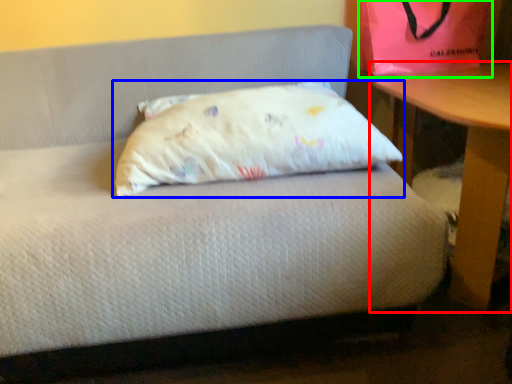
Question: Based on their relative distances, which object is farther from table (highlighted by a red box)? Choose from pillow (highlighted by a blue box) and bean bag chair (highlighted by a green box).

Choices:
 (A) pillow
 (B) bean bag chair

Answer: (A)